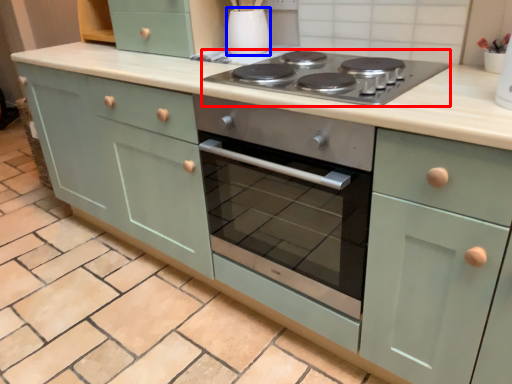
Question: Which of the following is the closest to the observer, gas stove (highlighted by a red box) or appliance (highlighted by a blue box)?

Choices:
 (A) gas stove
 (B) appliance

Answer: (A)